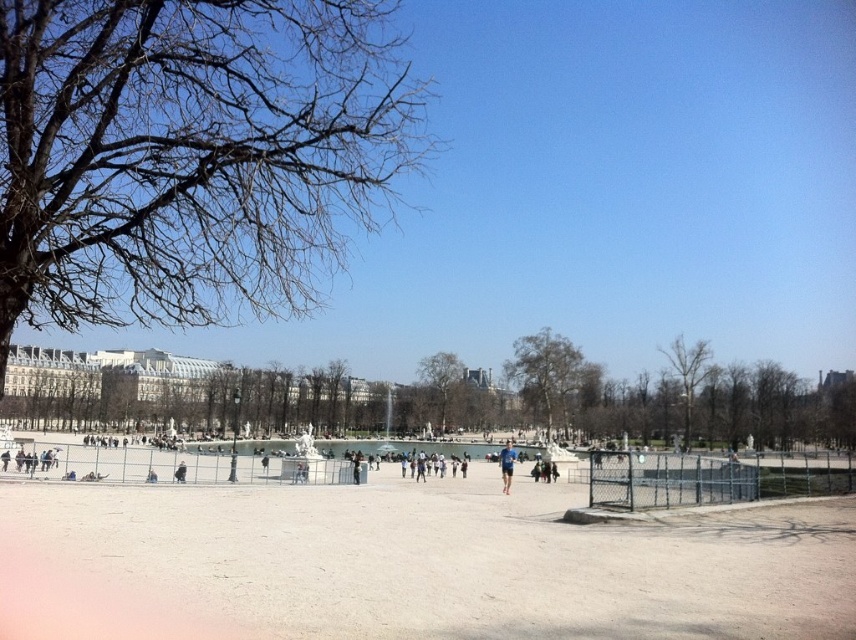
You are standing at the point labeled as point (547, 376) in the park. What is the nearest object to you?

The nearest object to you is the green leafy tree at center because the point (547, 376) is located on it.

You are a park visitor standing at the entrance of the park. You notice two trees in the distance. One is the bare branches at upper left and the other is the brown textured tree at center. Which tree is taller?

The brown textured tree at center is taller than the bare branches at upper left.

You are standing in the park and want to take a photo of the bare branches at upper left. Where should you position yourself to capture the branches in the upper left corner of your camera frame?

To capture the bare branches at upper left in the upper left corner of your camera frame, position yourself such that the branches are aligned with the upper left corner of your viewfinder. Since the bare branches at upper left are located at coordinates approximately 0.242 on the x and 0.224 on the y axis, you should adjust your camera angle so that these coordinates align with the upper left corner of your frame.